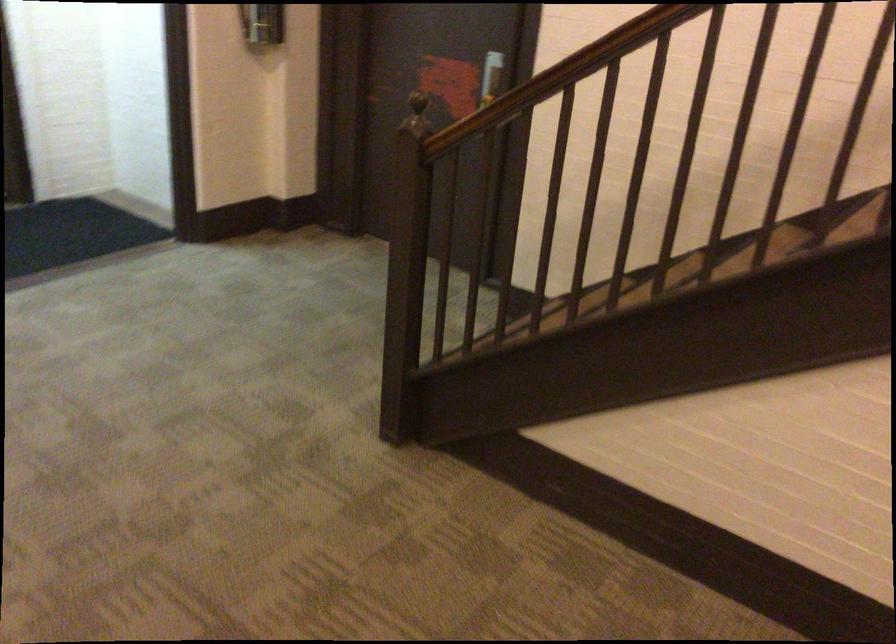
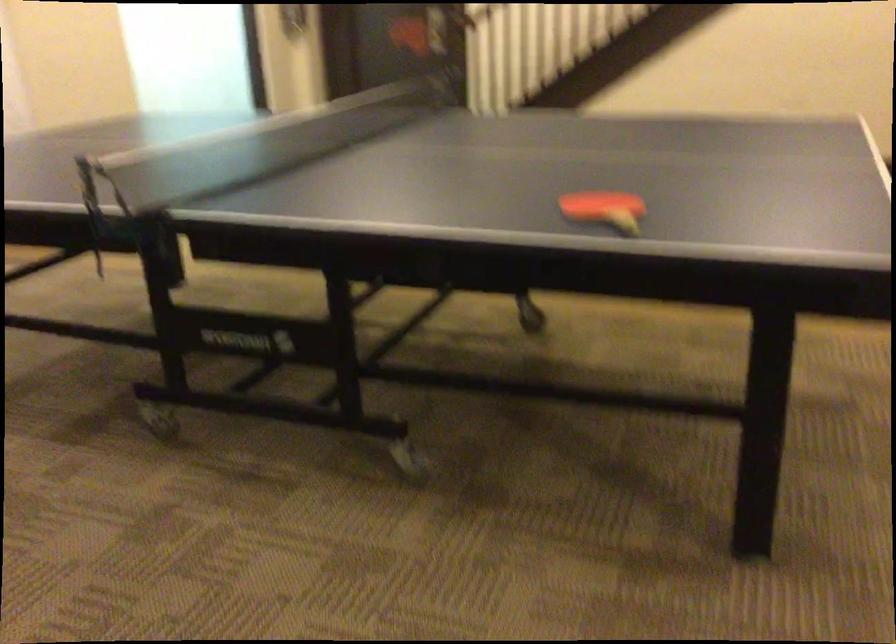
What movement of the cameraman would produce the second image?

The movement direction of the cameraman is left, backward.